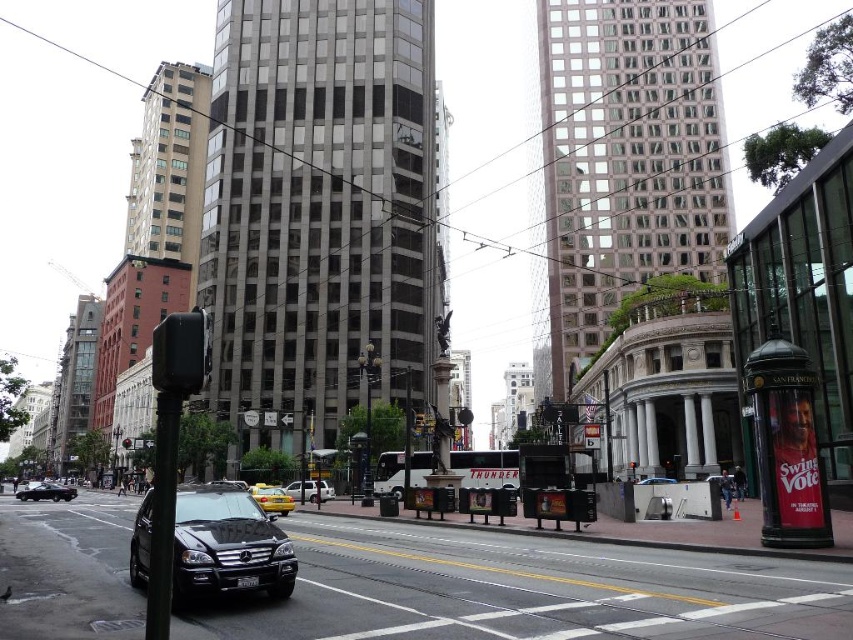
Which is in front, point (654, 481) or point (128, 438)?

Positioned in front is point (654, 481).

Which is above, black glossy sedan at center or metallic traffic light at upper center?

Positioned higher is black glossy sedan at center.

Is point (666, 477) behind point (126, 440)?

That is False.

This screenshot has width=853, height=640. I want to click on black glossy sedan at center, so click(656, 481).

Can you confirm if yellow matte taxi at center is positioned to the right of black glossy sedan at center?

In fact, yellow matte taxi at center is to the left of black glossy sedan at center.

Image resolution: width=853 pixels, height=640 pixels. I want to click on yellow matte taxi at center, so click(271, 499).

I want to click on yellow matte taxi at center, so click(x=271, y=499).

Does point (294, 483) come farther from viewer compared to point (123, 442)?

That is False.

Locate an element on the screen. Image resolution: width=853 pixels, height=640 pixels. metallic silver sedan at center is located at coordinates (302, 490).